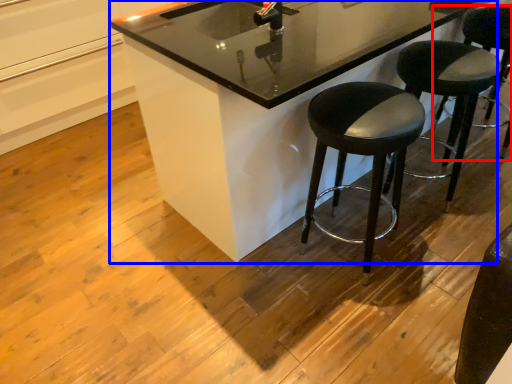
Question: Which object appears closest to the camera in this image, stool (highlighted by a red box) or counter (highlighted by a blue box)?

Choices:
 (A) stool
 (B) counter

Answer: (B)